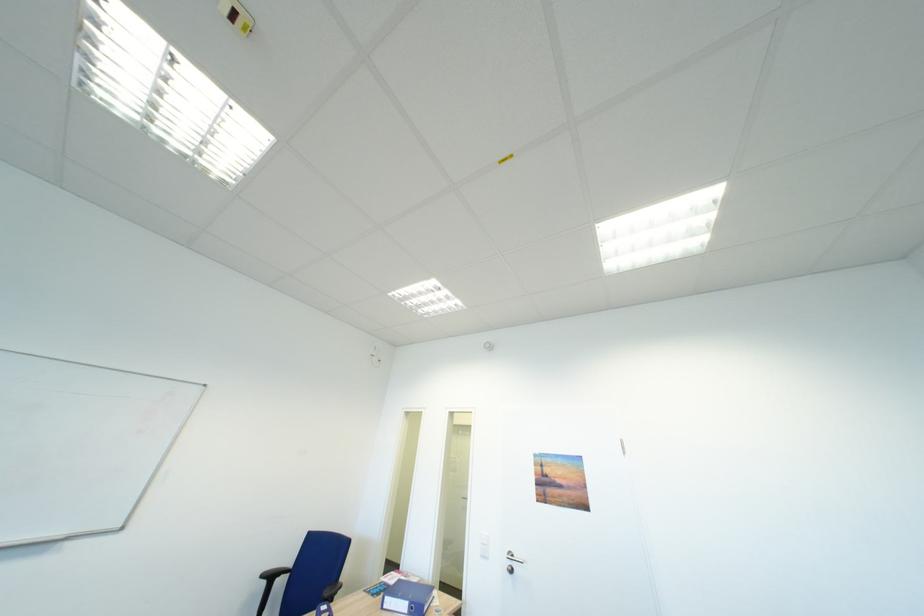
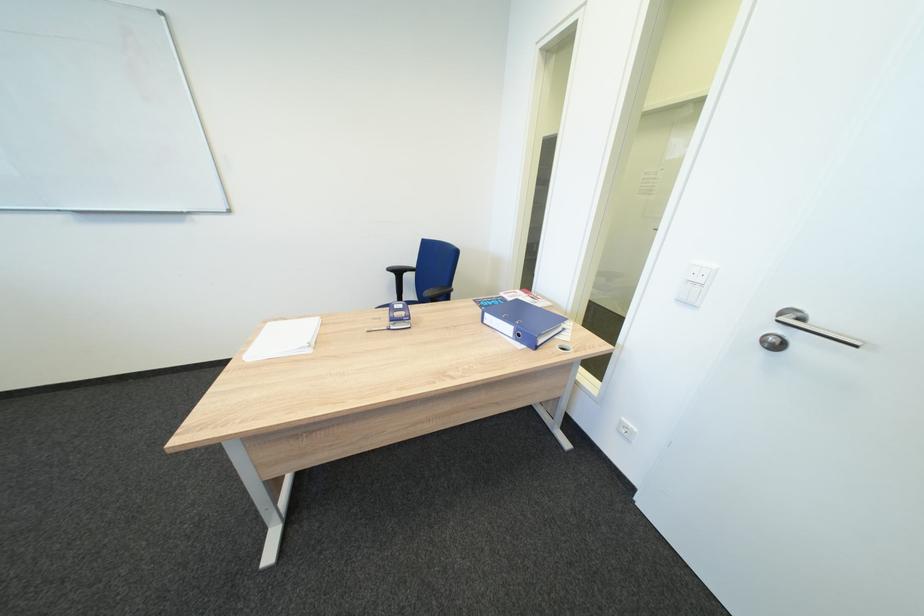
The point at (274, 578) is marked in the first image. Where is the corresponding point in the second image?

(400, 270)